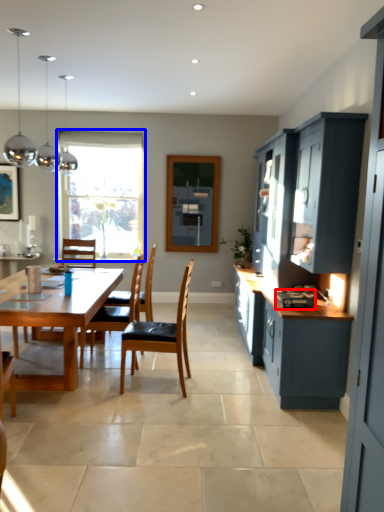
Question: Which of the following is the farthest to the observer, appliance (highlighted by a red box) or window (highlighted by a blue box)?

Choices:
 (A) appliance
 (B) window

Answer: (B)